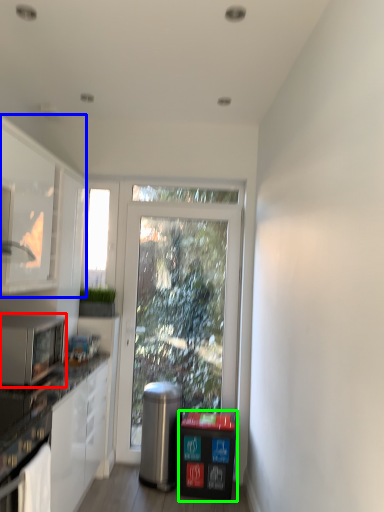
Question: Which object is the farthest from microwave oven (highlighted by a red box)? Choose among these: cabinetry (highlighted by a blue box) or recycling bin (highlighted by a green box).

Choices:
 (A) cabinetry
 (B) recycling bin

Answer: (B)